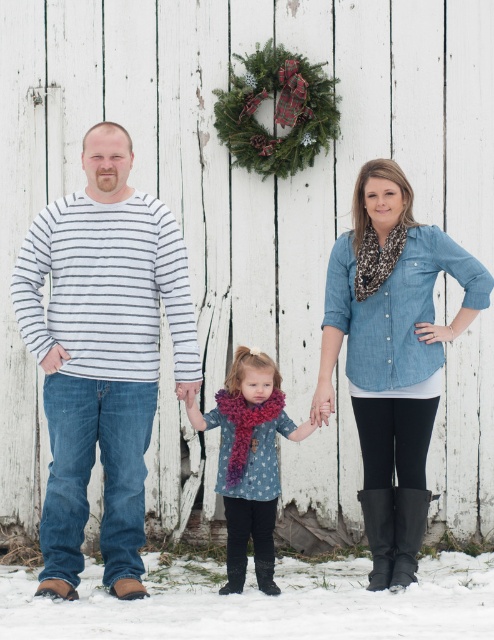
You are a photographer trying to capture the family in the image. You notice two shirts at the center of the scene. Which shirt is on the left side when looking at the striped cotton shirt at center and the chambray shirt at center?

The striped cotton shirt at center is positioned on the left side of the chambray shirt at center.

You are standing in front of the rustic wooden wall and want to place a decoration. You have two points marked on the wall where you can hang items. The points are labeled as point 1 at coordinates point (28, 308) and point 2 at coordinates point (279, 381). If you want to hang an item closer to your face level, which point should you choose?

Point 1 at coordinates point (28, 308) is closer to the viewer than point (279, 381), so you should choose point 1 to hang the item closer to your face level.